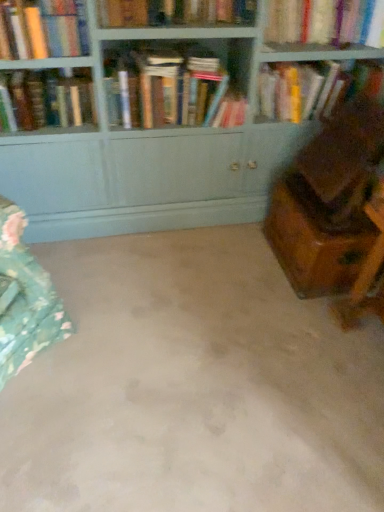
What is the approximate width of wooden chest at right?

It is 15.65 inches.

Describe the element at coordinates (312, 88) in the screenshot. I see `hardcover book at upper right, placed as the first book when sorted from right to left` at that location.

What is the approximate width of beige carpet at center?

beige carpet at center is 5.07 feet wide.

What do you see at coordinates (51, 99) in the screenshot?
I see `hardcover book at upper left, which appears as the 6th book when viewed from the right` at bounding box center [51, 99].

This screenshot has width=384, height=512. I want to click on wooden chest at right, so click(x=314, y=239).

Is beige carpet at center surrounded by hardcover book at upper right, the 6th book viewed from the left?

Actually, beige carpet at center is outside hardcover book at upper right, the 6th book viewed from the left.

From their relative heights in the image, would you say hardcover book at upper right, the 6th book viewed from the left, is taller or shorter than beige carpet at center?

In the image, hardcover book at upper right, the 6th book viewed from the left, appears to be taller than beige carpet at center.

Which book is the 6th one when counting from the back of the beige carpet at center? Please provide its 2D coordinates.

[(312, 88)]

Can you tell me how much hardcover book at upper right, placed as the first book when sorted from right to left, and beige carpet at center differ in facing direction?

179 degrees.

Considering the positions of objects beige carpet at center and hardcover book at upper left, which appears as the first book when viewed from the left, in the image provided, who is more to the left, beige carpet at center or hardcover book at upper left, which appears as the first book when viewed from the left,?

Positioned to the left is hardcover book at upper left, which appears as the first book when viewed from the left.

Looking at the image, does beige carpet at center seem bigger or smaller compared to hardcover book at upper left, which appears as the 6th book when viewed from the right?

Clearly, beige carpet at center is larger in size than hardcover book at upper left, which appears as the 6th book when viewed from the right.

Is hardcover book at upper left, which appears as the 6th book when viewed from the right, at the back of beige carpet at center?

No, beige carpet at center is not facing away from hardcover book at upper left, which appears as the 6th book when viewed from the right.

Consider the image. Is hardcover book at upper left, which appears as the 6th book when viewed from the right, inside beige carpet at center?

No, hardcover book at upper left, which appears as the 6th book when viewed from the right, is located outside of beige carpet at center.

Considering the sizes of beige carpet at center and hardcover book at upper right, the 6th book viewed from the left, in the image, is beige carpet at center wider or thinner than hardcover book at upper right, the 6th book viewed from the left,?

Considering their sizes, beige carpet at center looks broader than hardcover book at upper right, the 6th book viewed from the left.

Does beige carpet at center contain hardcover book at upper right, placed as the first book when sorted from right to left?

No, hardcover book at upper right, placed as the first book when sorted from right to left, is not inside beige carpet at center.

From the image's perspective, does beige carpet at center appear lower than hardcover book at upper right, placed as the first book when sorted from right to left?

Yes, from the image's perspective, beige carpet at center is below hardcover book at upper right, placed as the first book when sorted from right to left.

Is beige carpet at center with hardcover book at upper right, placed as the first book when sorted from right to left?

beige carpet at center and hardcover book at upper right, placed as the first book when sorted from right to left, are not in contact.

Looking at their sizes, would you say wooden chest at right is wider or thinner than hardcover book at upper left, which is the second book from left to right?

In the image, wooden chest at right appears to be wider than hardcover book at upper left, which is the second book from left to right.

Is wooden chest at right outside of hardcover book at upper left, which is the second book from left to right?

Yes, wooden chest at right is outside of hardcover book at upper left, which is the second book from left to right.

From a real-world perspective, is wooden chest at right on top of hardcover book at upper left, which is the second book from left to right?

No, from a real-world perspective, wooden chest at right is not above hardcover book at upper left, which is the second book from left to right.

What's the angular difference between wooden chest at right and hardcover book at upper left, which is the second book from left to right,'s facing directions?

90 degrees.

From the image's perspective, is hardcover books at center, positioned as the 3th book in left-to-right order, located above or below matte wood bookcase at upper center?

From the image's perspective, hardcover books at center, positioned as the 3th book in left-to-right order, appears above matte wood bookcase at upper center.

From a real-world perspective, does hardcover books at center, marked as the 4th book in a right-to-left arrangement, stand above matte wood bookcase at upper center?

Correct, in the physical world, hardcover books at center, marked as the 4th book in a right-to-left arrangement, is higher than matte wood bookcase at upper center.

Looking at the image, does wooden chest at right seem bigger or smaller compared to beige carpet at center?

Considering their sizes, wooden chest at right takes up less space than beige carpet at center.

Considering the relative sizes of wooden chest at right and beige carpet at center in the image provided, is wooden chest at right wider than beige carpet at center?

No, wooden chest at right is not wider than beige carpet at center.

Is wooden chest at right inside the boundaries of beige carpet at center, or outside?

The correct answer is: outside.

In the image, is wooden chest at right positioned in front of or behind beige carpet at center?

wooden chest at right is behind beige carpet at center.

Which book is the 1st one when counting from the right side of the hardcover books at center, positioned as the 3th book in left-to-right order? Please provide its 2D coordinates.

[(175, 12)]

Is hardcover book at upper center, arranged as the fourth book when viewed from the left, located outside hardcover books at center, marked as the 4th book in a right-to-left arrangement?

hardcover book at upper center, arranged as the fourth book when viewed from the left, lies outside hardcover books at center, marked as the 4th book in a right-to-left arrangement,'s area.

Could you tell me if hardcover book at upper center, arranged as the fourth book when viewed from the left, is facing hardcover books at center, marked as the 4th book in a right-to-left arrangement?

No, hardcover book at upper center, arranged as the fourth book when viewed from the left, is not aimed at hardcover books at center, marked as the 4th book in a right-to-left arrangement.

Who is smaller, hardcover book at upper center, the third book from the right, or hardcover books at center, positioned as the 3th book in left-to-right order?

hardcover book at upper center, the third book from the right.

Where is `the 2nd book to the right of the beige carpet at center, counting from the anchor's position`? This screenshot has width=384, height=512. the 2nd book to the right of the beige carpet at center, counting from the anchor's position is located at coordinates (312, 88).

This screenshot has width=384, height=512. There is a beige carpet at center. Find the location of `the 1st book above it (from the image's perspective)`. the 1st book above it (from the image's perspective) is located at coordinates (51, 99).

Looking at the image, which one is located closer to hardcover book at upper right, placed as the first book when sorted from right to left, hardcover books at center, marked as the 4th book in a right-to-left arrangement, or matte wood bookcase at upper center?

matte wood bookcase at upper center is closer to hardcover book at upper right, placed as the first book when sorted from right to left.

Which object lies further to the anchor point hardcover book at upper center, acting as the 5th book starting from the left, beige carpet at center or hardcover book at upper right, the 6th book viewed from the left?

beige carpet at center.

From the image, which object appears to be nearer to hardcover book at upper right, placed as the first book when sorted from right to left, hardcover books at center, marked as the 4th book in a right-to-left arrangement, or beige carpet at center?

hardcover books at center, marked as the 4th book in a right-to-left arrangement, lies closer to hardcover book at upper right, placed as the first book when sorted from right to left, than the other object.

Estimate the real-world distances between objects in this image. Which object is further from wooden chest at right, hardcover book at upper center, acting as the 5th book starting from the left, or hardcover book at upper center, the third book from the right?

Based on the image, hardcover book at upper center, the third book from the right, appears to be further to wooden chest at right.

Looking at the image, which one is located further to hardcover book at upper center, which is the second book in right-to-left order, wooden chest at right or hardcover book at upper left, which appears as the 6th book when viewed from the right?

hardcover book at upper left, which appears as the 6th book when viewed from the right.

Estimate the real-world distances between objects in this image. Which object is closer to matte wood bookcase at upper center, hardcover books at center, positioned as the 3th book in left-to-right order, or hardcover book at upper left, which appears as the first book when viewed from the left?

hardcover books at center, positioned as the 3th book in left-to-right order, is positioned closer to the anchor matte wood bookcase at upper center.

Considering their positions, is matte wood bookcase at upper center positioned further to beige carpet at center than hardcover book at upper center, arranged as the fourth book when viewed from the left?

hardcover book at upper center, arranged as the fourth book when viewed from the left.

From the image, which object appears to be farther from hardcover book at upper center, acting as the 5th book starting from the left, matte wood bookcase at upper center or hardcover book at upper center, arranged as the fourth book when viewed from the left?

Based on the image, matte wood bookcase at upper center appears to be further to hardcover book at upper center, acting as the 5th book starting from the left.

Locate an element on the screen. Image resolution: width=384 pixels, height=512 pixels. bookcase that lies between hardcover book at upper center, which is the second book in right-to-left order, and beige carpet at center from top to bottom is located at coordinates (152, 158).

Where is `bookcase between hardcover book at upper left, which ranks as the fifth book in right-to-left order, and beige carpet at center vertically`? bookcase between hardcover book at upper left, which ranks as the fifth book in right-to-left order, and beige carpet at center vertically is located at coordinates (152, 158).

Identify the location of bookcase between hardcover book at upper left, which appears as the first book when viewed from the left, and beige carpet at center, in the vertical direction. (152, 158).

The height and width of the screenshot is (512, 384). Identify the location of bookcase between hardcover book at upper center, the third book from the right, and hardcover book at upper center, which is the second book in right-to-left order. (152, 158).